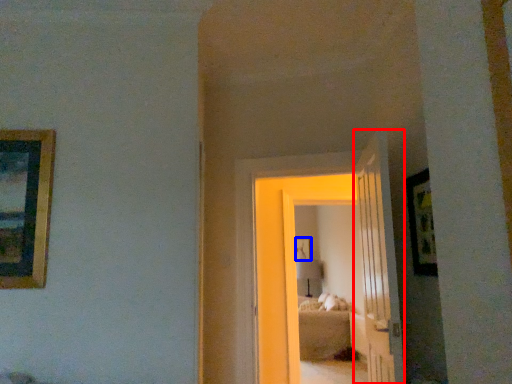
Question: Which of the following is the closest to the observer, door (highlighted by a red box) or picture frame (highlighted by a blue box)?

Choices:
 (A) door
 (B) picture frame

Answer: (A)